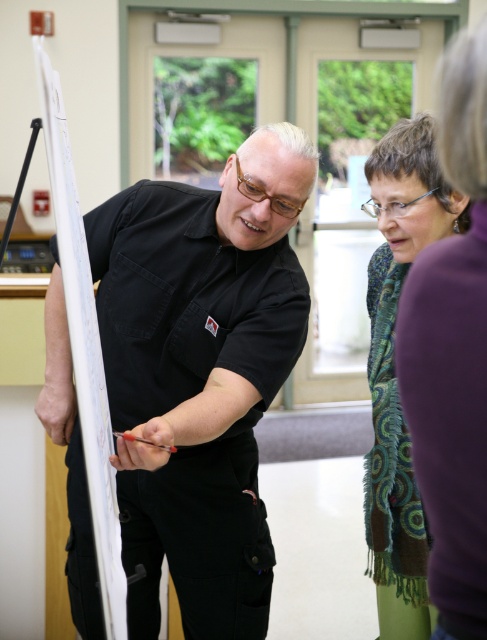
Which is more to the right, black cotton shirt at center or white paperboard at left?

Positioned to the right is black cotton shirt at center.

Is black cotton shirt at center to the right of white paperboard at left from the viewer's perspective?

Indeed, black cotton shirt at center is positioned on the right side of white paperboard at left.

Between point (266, 576) and point (76, 241), which one is positioned behind?

The point (266, 576) is behind.

Locate an element on the screen. The width and height of the screenshot is (487, 640). black cotton shirt at center is located at coordinates [201, 371].

Between point (423, 124) and point (94, 344), which one is positioned behind?

The point (423, 124) is more distant.

Between point (411, 573) and point (76, 227), which one is positioned behind?

The point (411, 573) is more distant.

Where is `green textured scarf at center`? green textured scarf at center is located at coordinates (394, 371).

Does black cotton shirt at center have a lesser width compared to green textured scarf at center?

In fact, black cotton shirt at center might be wider than green textured scarf at center.

Can you confirm if black cotton shirt at center is shorter than green textured scarf at center?

Correct, black cotton shirt at center is not as tall as green textured scarf at center.

The image size is (487, 640). What do you see at coordinates (201, 371) in the screenshot? I see `black cotton shirt at center` at bounding box center [201, 371].

Where is `black cotton shirt at center`? This screenshot has height=640, width=487. black cotton shirt at center is located at coordinates (201, 371).